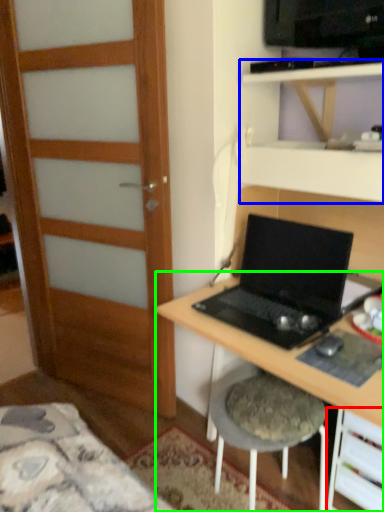
Question: Based on their relative distances, which object is nearer to drawer (highlighted by a red box)? Choose from shelf (highlighted by a blue box) and desk (highlighted by a green box).

Choices:
 (A) shelf
 (B) desk

Answer: (B)